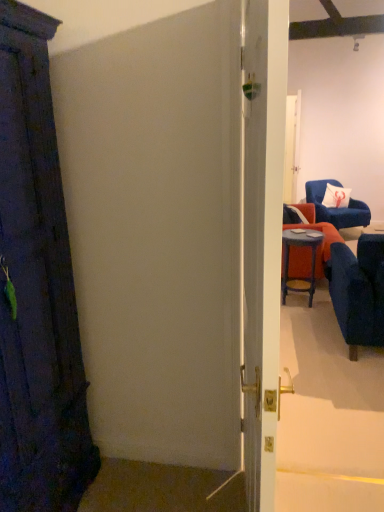
Question: Is white fabric pillow at upper right positioned before matte blue stool at right?

Choices:
 (A) no
 (B) yes

Answer: (A)

Question: Does white fabric pillow at upper right have a greater height compared to matte blue stool at right?

Choices:
 (A) no
 (B) yes

Answer: (A)

Question: Considering the relative sizes of white fabric pillow at upper right and matte blue stool at right in the image provided, is white fabric pillow at upper right wider than matte blue stool at right?

Choices:
 (A) yes
 (B) no

Answer: (B)

Question: Can you confirm if white fabric pillow at upper right is positioned to the left of matte blue stool at right?

Choices:
 (A) yes
 (B) no

Answer: (B)

Question: Is white fabric pillow at upper right next to matte blue stool at right?

Choices:
 (A) no
 (B) yes

Answer: (A)

Question: Visually, is white glossy door at center positioned to the left or to the right of velvet blue armchair at upper right, arranged as the 2th chair when ordered from the bottom?

Choices:
 (A) right
 (B) left

Answer: (B)

Question: Considering the positions of white glossy door at center and velvet blue armchair at upper right, positioned as the first chair in right-to-left order, in the image, is white glossy door at center taller or shorter than velvet blue armchair at upper right, positioned as the first chair in right-to-left order,?

Choices:
 (A) tall
 (B) short

Answer: (A)

Question: Is white glossy door at center inside the boundaries of velvet blue armchair at upper right, positioned as the first chair in right-to-left order, or outside?

Choices:
 (A) inside
 (B) outside

Answer: (B)

Question: From a real-world perspective, is white glossy door at center positioned above or below velvet blue armchair at upper right, the second chair from the front?

Choices:
 (A) above
 (B) below

Answer: (A)

Question: Considering their positions, is velvet blue armchair at right, which ranks as the first chair in front-to-back order, located in front of or behind velvet blue armchair at upper right, marked as the 2th chair in a left-to-right arrangement?

Choices:
 (A) behind
 (B) front

Answer: (B)

Question: From a real-world perspective, is velvet blue armchair at right, which is counted as the 2th chair, starting from the top, above or below velvet blue armchair at upper right, arranged as the 1th chair when viewed from the top?

Choices:
 (A) below
 (B) above

Answer: (B)

Question: Is velvet blue armchair at right, the second chair positioned from the right, bigger or smaller than velvet blue armchair at upper right, positioned as the first chair in right-to-left order?

Choices:
 (A) big
 (B) small

Answer: (B)

Question: From the image's perspective, is velvet blue armchair at right, which is the 2th chair in back-to-front order, above or below velvet blue armchair at upper right, positioned as the first chair in right-to-left order?

Choices:
 (A) below
 (B) above

Answer: (A)

Question: From a real-world perspective, is velvet blue armchair at upper right, arranged as the 2th chair when ordered from the bottom, above or below white fabric pillow at upper right?

Choices:
 (A) above
 (B) below

Answer: (B)

Question: Is velvet blue armchair at upper right, positioned as the first chair in right-to-left order, wider or thinner than white fabric pillow at upper right?

Choices:
 (A) thin
 (B) wide

Answer: (B)